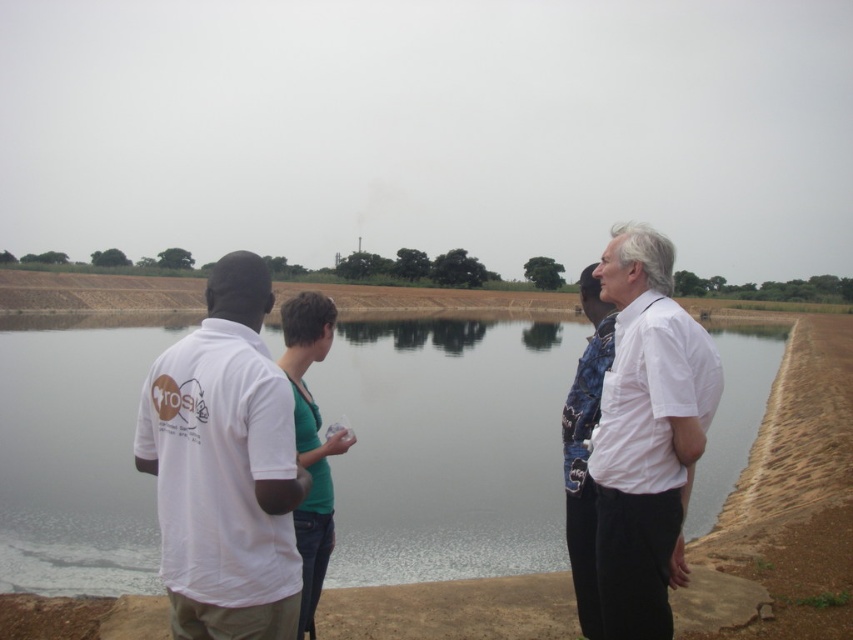
Between clear water at center and white cotton shirt at right, which one is positioned higher?

clear water at center is above.

Which is more to the right, clear water at center or white cotton shirt at right?

white cotton shirt at right is more to the right.

Which is behind, point (476, 520) or point (625, 305)?

Positioned behind is point (476, 520).

Identify the location of clear water at center. This screenshot has height=640, width=853. (447, 445).

Which is above, white cotton shirt at left or white cotton shirt at right?

Positioned higher is white cotton shirt at left.

Between point (167, 436) and point (712, 412), which one is positioned in front?

Point (167, 436) is in front.

Is point (213, 456) closer to viewer compared to point (664, 586)?

Yes, it is in front of point (664, 586).

This screenshot has height=640, width=853. What are the coordinates of `white cotton shirt at left` in the screenshot? It's located at (224, 467).

Can you confirm if clear water at center is smaller than white cotton shirt at left?

Incorrect, clear water at center is not smaller in size than white cotton shirt at left.

The image size is (853, 640). I want to click on clear water at center, so click(447, 445).

Identify the location of clear water at center. The width and height of the screenshot is (853, 640). (447, 445).